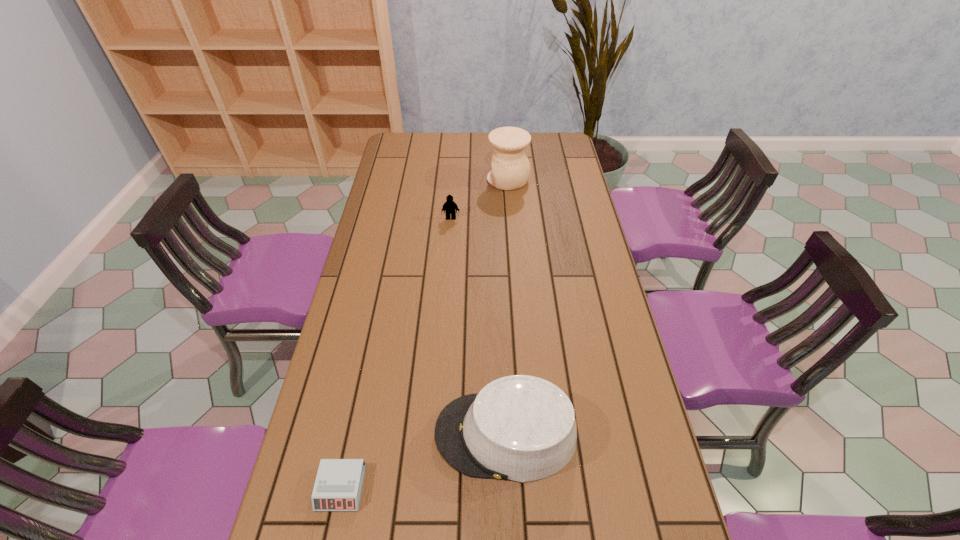
You are a GUI agent. You are given a task and a screenshot of the screen. Output one action in this format:
    pyautogui.click(x=<x>, y=<y>)
    Task: Click on the second closest object to the pottery
    
    Given the screenshot: What is the action you would take?
    pyautogui.click(x=521, y=428)

I want to click on vacant space that satisfies the following two spatial constraints: 1. at the open side of the tallest object; 2. on the face of the second shortest object, so (512, 218).